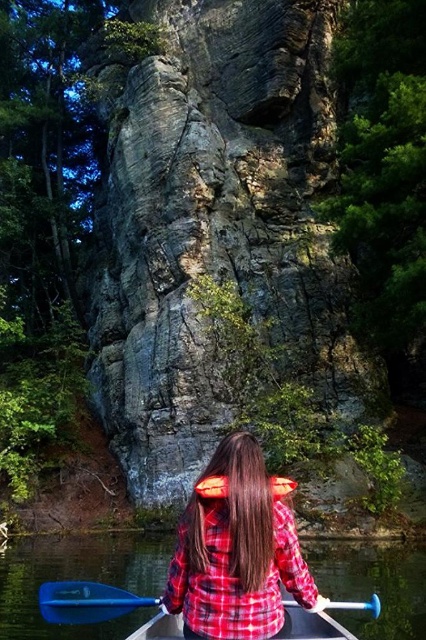
Question: Which object is the farthest from the clear water at lower center?

Choices:
 (A) blue plastic canoe at center
 (B) plaid fabric shirt at center
 (C) gray rough rock at center
 (D) blue plastic paddle at lower center

Answer: (C)

Question: Based on their relative distances, which object is farther from the blue plastic paddle at lower center?

Choices:
 (A) blue plastic canoe at center
 (B) clear water at lower center
 (C) gray rough rock at center

Answer: (C)

Question: In this image, where is gray rough rock at center located relative to plaid fabric shirt at center?

Choices:
 (A) left
 (B) right

Answer: (A)

Question: Does gray rough rock at center appear on the right side of plaid fabric shirt at center?

Choices:
 (A) no
 (B) yes

Answer: (A)

Question: Which object is positioned farthest from the blue plastic canoe at center?

Choices:
 (A) blue plastic paddle at lower center
 (B) plaid fabric shirt at center
 (C) clear water at lower center
 (D) gray rough rock at center

Answer: (D)

Question: Is plaid fabric shirt at center to the right of blue plastic canoe at center from the viewer's perspective?

Choices:
 (A) yes
 (B) no

Answer: (B)